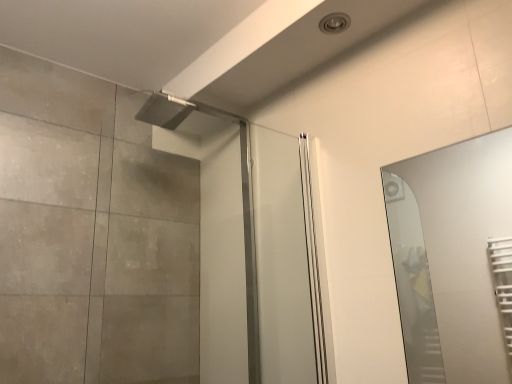
Question: Is clear glass screen door at upper center at the left side of clear glass mirror at right?

Choices:
 (A) no
 (B) yes

Answer: (B)

Question: From a real-world perspective, is clear glass screen door at upper center over clear glass mirror at right?

Choices:
 (A) no
 (B) yes

Answer: (B)

Question: Is clear glass screen door at upper center smaller than clear glass mirror at right?

Choices:
 (A) no
 (B) yes

Answer: (A)

Question: Does clear glass screen door at upper center have a greater width compared to clear glass mirror at right?

Choices:
 (A) no
 (B) yes

Answer: (B)

Question: Is clear glass screen door at upper center oriented away from clear glass mirror at right?

Choices:
 (A) no
 (B) yes

Answer: (A)

Question: Is clear glass screen door at upper center touching clear glass mirror at right?

Choices:
 (A) yes
 (B) no

Answer: (B)

Question: Is clear glass mirror at right positioned behind clear glass screen door at upper center?

Choices:
 (A) yes
 (B) no

Answer: (B)

Question: From the image's perspective, is clear glass mirror at right beneath clear glass screen door at upper center?

Choices:
 (A) yes
 (B) no

Answer: (A)

Question: Is clear glass screen door at upper center surrounded by clear glass mirror at right?

Choices:
 (A) yes
 (B) no

Answer: (B)

Question: Is clear glass mirror at right oriented towards clear glass screen door at upper center?

Choices:
 (A) no
 (B) yes

Answer: (A)

Question: Considering the relative sizes of clear glass mirror at right and clear glass screen door at upper center in the image provided, is clear glass mirror at right wider than clear glass screen door at upper center?

Choices:
 (A) yes
 (B) no

Answer: (B)

Question: From a real-world perspective, is clear glass mirror at right located higher than clear glass screen door at upper center?

Choices:
 (A) no
 (B) yes

Answer: (A)

Question: From a real-world perspective, is clear glass screen door at upper center above or below clear glass mirror at right?

Choices:
 (A) below
 (B) above

Answer: (B)